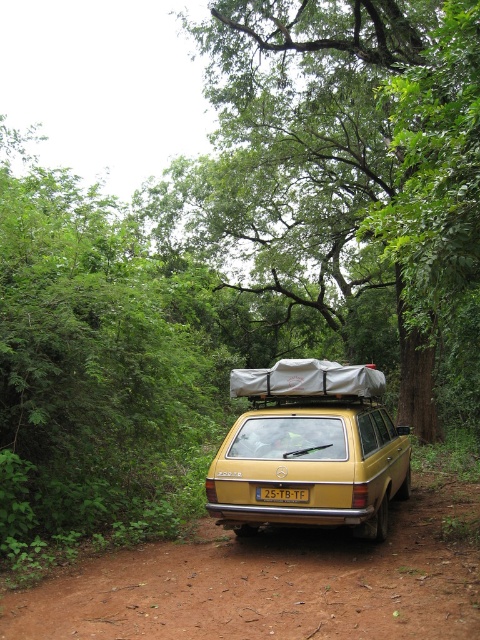
You are a photographer standing at the camera position. You want to take a picture of the green leafy tree at center. Since you have a camera with a fixed focus of 3 meters, will you be able to capture the tree in focus?

The distance between the green leafy tree at center and the camera is 3.57 meters, which is beyond the camera focus range of 3 meters. Therefore, the tree will not be in focus.

You are a hiker who wants to take a photo of the vintage yellow Mercedes Benz 200 TD station wagon parked on the dirt path. There is a green leafy tree at center represented by point (x=347, y=180). Where should you stand to ensure the tree is not blocking the view of the car?

To avoid the green leafy tree at center represented by point (x=347, y=180) blocking the view, you should position yourself to the left or right of the tree point so that the car remains visible in your frame.